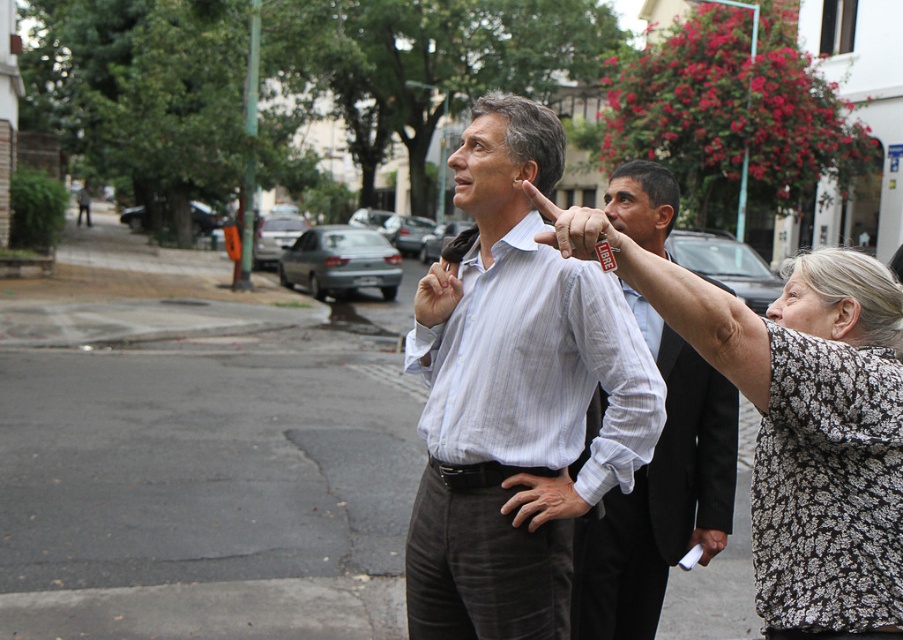
Does black floral-patterned blouse at upper right have a greater width compared to white striped dress shirt at center?

Incorrect, black floral-patterned blouse at upper right's width does not surpass white striped dress shirt at center's.

Is point (874, 356) more distant than point (585, 296)?

No.

Where is `black floral-patterned blouse at upper right`? This screenshot has height=640, width=903. black floral-patterned blouse at upper right is located at coordinates (832, 460).

Who is more distant from viewer, (579, 392) or (574, 244)?

The point (579, 392) is behind.

Between white striped dress shirt at center and matte plastic finger at center, which one has more height?

Standing taller between the two is white striped dress shirt at center.

Where is `white striped dress shirt at center`? The image size is (903, 640). white striped dress shirt at center is located at coordinates (538, 365).

Who is higher up, floral-patterned blouse at center or matte plastic finger at center?

Positioned higher is matte plastic finger at center.

Between point (653, 291) and point (571, 240), which one is positioned behind?

The point (653, 291) is more distant.

Identify the location of floral-patterned blouse at center. (807, 429).